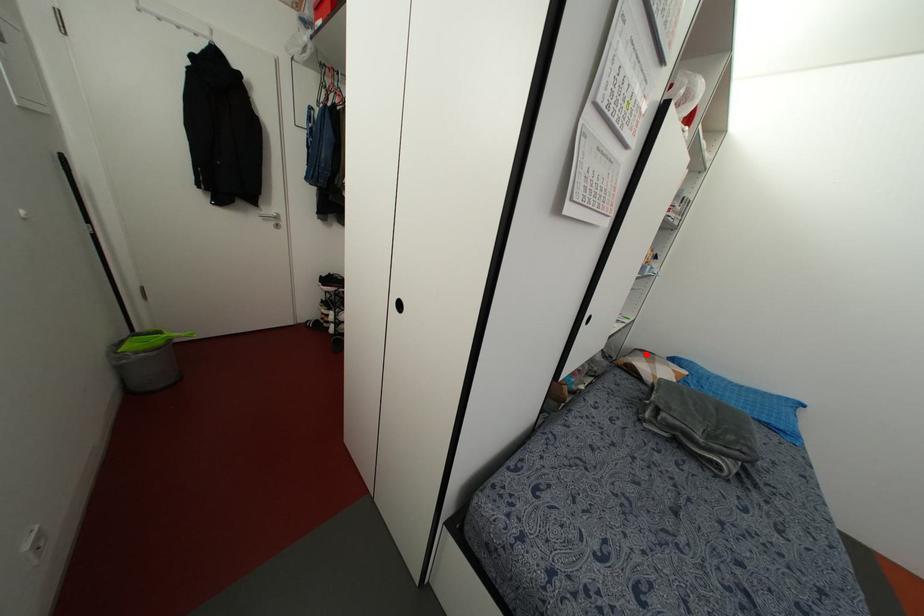
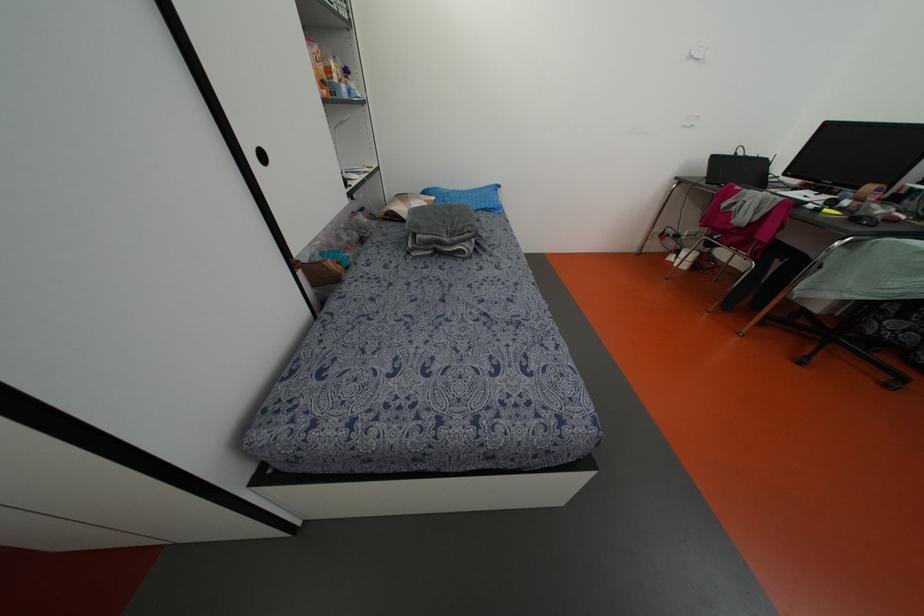
Question: A red point is marked in image1. In image2, is the corresponding 3D point closer to the camera or farther? Reply with the corresponding letter.

Choices:
 (A) The corresponding 3D point is closer.
 (B) The corresponding 3D point is farther.

Answer: (A)